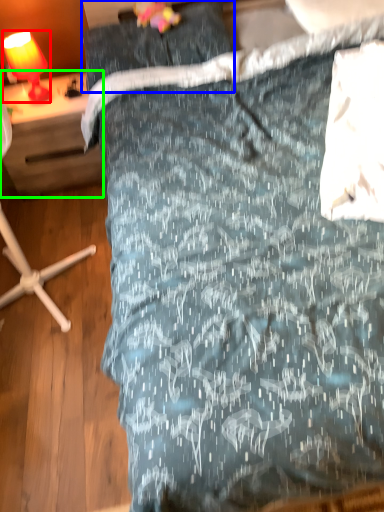
Question: Estimate the real-world distances between objects in this image. Which object is closer to lamp (highlighted by a red box), pillow (highlighted by a blue box) or desk (highlighted by a green box)?

Choices:
 (A) pillow
 (B) desk

Answer: (B)